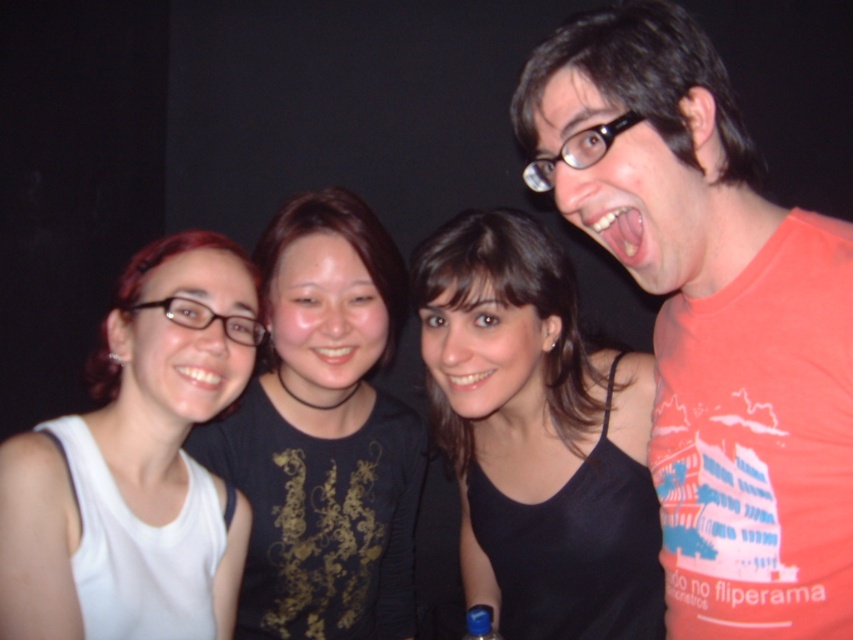
Can you confirm if orange cotton t-shirt at right is smaller than black matte shirt at center?

Yes, orange cotton t-shirt at right is smaller than black matte shirt at center.

Is point (740, 346) closer to viewer compared to point (270, 612)?

Yes, point (740, 346) is closer to viewer.

You are a GUI agent. You are given a task and a screenshot of the screen. Output one action in this format:
    pyautogui.click(x=<x>, y=<y>)
    Task: Click on the orange cotton t-shirt at right
    This screenshot has width=853, height=640.
    Given the screenshot: What is the action you would take?
    pyautogui.click(x=714, y=323)

Does black fabric at center have a greater width compared to black matte shirt at center?

No.

Is point (567, 600) positioned before point (236, 611)?

Yes, it is.

Image resolution: width=853 pixels, height=640 pixels. What do you see at coordinates (537, 436) in the screenshot?
I see `black fabric at center` at bounding box center [537, 436].

This screenshot has height=640, width=853. In order to click on black fabric at center in this screenshot , I will do `click(537, 436)`.

Does orange cotton t-shirt at right appear on the right side of black fabric at center?

Correct, you'll find orange cotton t-shirt at right to the right of black fabric at center.

Is point (751, 193) positioned after point (569, 588)?

No, it is in front of (569, 588).

The image size is (853, 640). In order to click on orange cotton t-shirt at right in this screenshot , I will do [x=714, y=323].